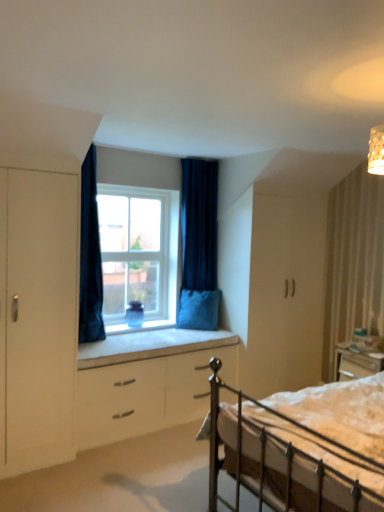
Identify the location of free space above dark blue velvet curtain at upper center, placed as the 1th curtain when sorted from front to back (from a real-world perspective). (104, 138).